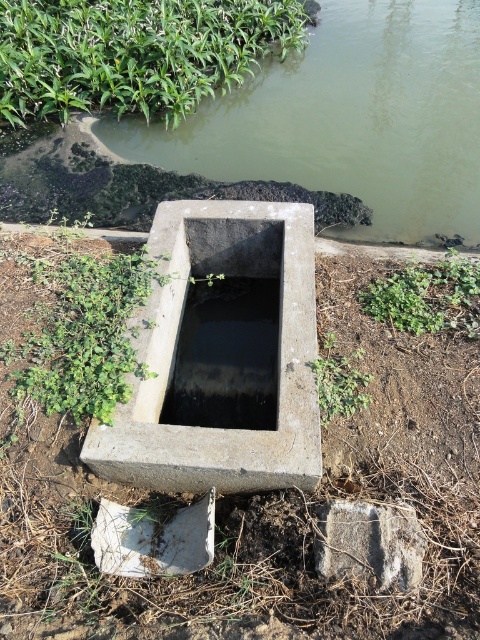
Can you confirm if concrete rectangular at center is smaller than concreteroughwater channel at center?

Actually, concrete rectangular at center might be larger than concreteroughwater channel at center.

Between concrete rectangular at center and concreteroughwater channel at center, which one is positioned lower?

concreteroughwater channel at center

What do you see at coordinates (348, 118) in the screenshot? This screenshot has width=480, height=640. I see `concrete rectangular at center` at bounding box center [348, 118].

At what (x,y) coordinates should I click in order to perform the action: click on concrete rectangular at center. Please return your answer as a coordinate pair (x, y). Looking at the image, I should click on (348, 118).

Is green leafy plant at upper left bigger than green leafy plant at lower right?

Yes.

Is point (38, 81) closer to camera compared to point (391, 285)?

That is False.

This screenshot has width=480, height=640. Describe the element at coordinates (133, 52) in the screenshot. I see `green leafy plant at upper left` at that location.

Where is `green leafy plant at upper left`? The width and height of the screenshot is (480, 640). green leafy plant at upper left is located at coordinates (133, 52).

Who is lower down, gray rough concrete at lower center or green leafy plant at lower center?

gray rough concrete at lower center is lower down.

Which is above, gray rough concrete at lower center or green leafy plant at lower center?

Positioned higher is green leafy plant at lower center.

You are a GUI agent. You are given a task and a screenshot of the screen. Output one action in this format:
    pyautogui.click(x=<x>, y=<y>)
    Task: Click on the gray rough concrete at lower center
    This screenshot has width=480, height=640.
    Given the screenshot: What is the action you would take?
    pyautogui.click(x=370, y=541)

At what (x,y) coordinates should I click in order to perform the action: click on gray rough concrete at lower center. Please return your answer as a coordinate pair (x, y). The image size is (480, 640). Looking at the image, I should click on (370, 541).